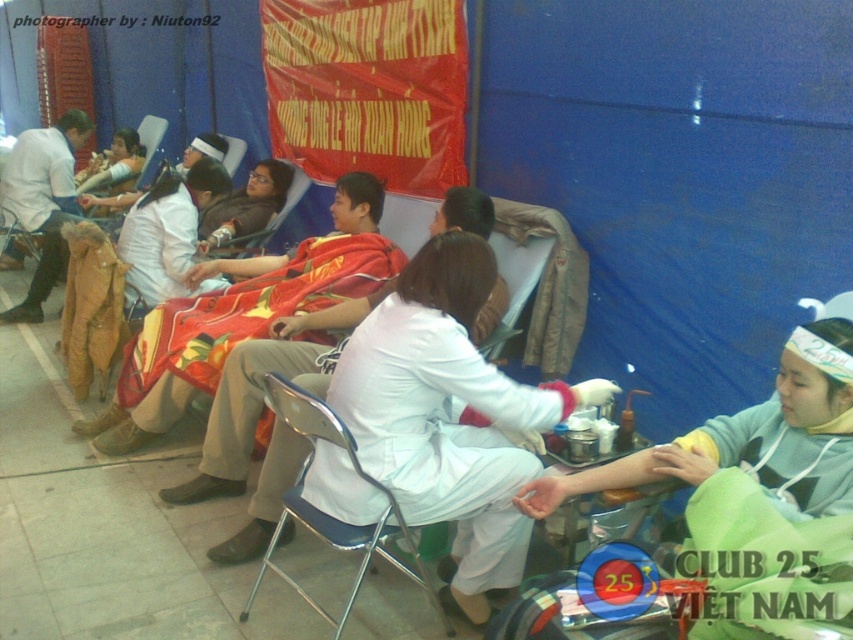
Is matte brown boots at left to the left of matte white shirt at upper left from the viewer's perspective?

Correct, you'll find matte brown boots at left to the left of matte white shirt at upper left.

Between point (48, 246) and point (131, 172), which one is positioned behind?

Positioned behind is point (131, 172).

Find the location of a particular element. matte brown boots at left is located at coordinates (44, 198).

Find the location of a particular element. Image resolution: width=853 pixels, height=640 pixels. matte brown boots at left is located at coordinates (44, 198).

Does matte brown boots at left have a smaller size compared to matte black jacket at center?

No.

Does matte brown boots at left appear under matte black jacket at center?

No.

Between point (45, 129) and point (279, 202), which one is positioned behind?

Point (45, 129)

Where is `matte brown boots at left`? This screenshot has height=640, width=853. matte brown boots at left is located at coordinates [44, 198].

Does matte white coat at center have a smaller size compared to matte black jacket at center?

Actually, matte white coat at center might be larger than matte black jacket at center.

Locate an element on the screen. The width and height of the screenshot is (853, 640). matte white coat at center is located at coordinates (263, 392).